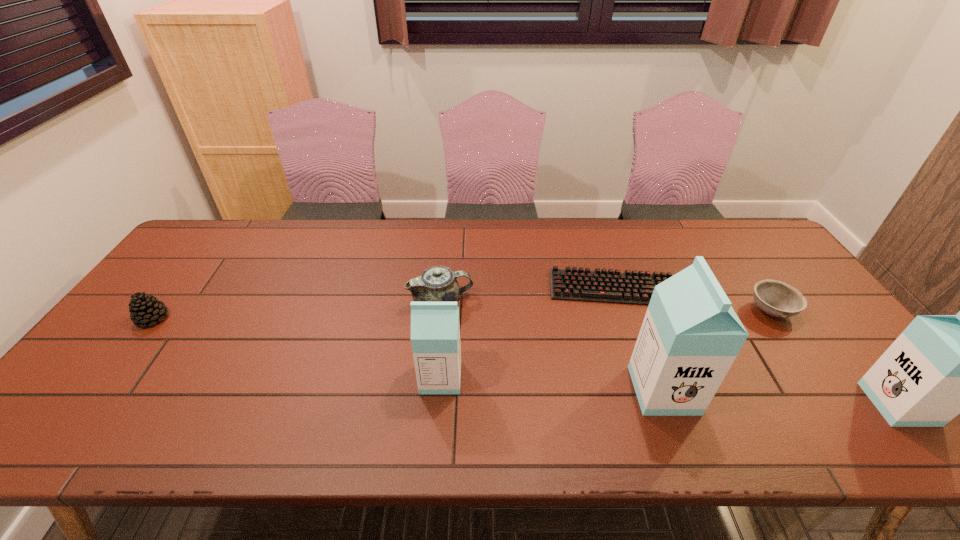
Please point a vacant point for placing a milk carton on the left. Please provide its 2D coordinates. Your answer should be formatted as a tuple, i.e. [(x, y)], where the tuple contains the x and y coordinates of a point satisfying the conditions above.

[(229, 365)]